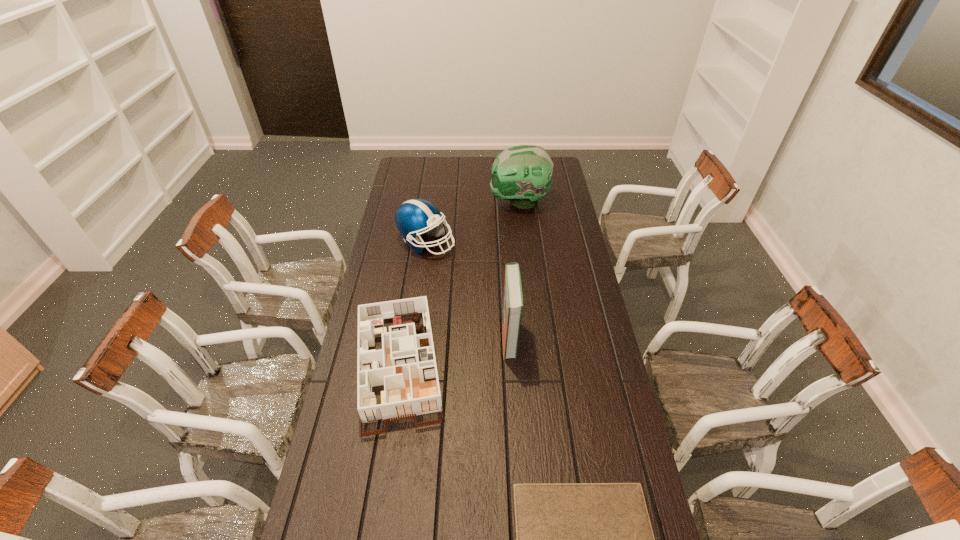
At what (x,y) coordinates should I click in order to perform the action: click on free space located on the cover of the hardback book. Please return your answer as a coordinate pair (x, y). This screenshot has height=540, width=960. Looking at the image, I should click on (421, 338).

Identify the location of vacant space located on the cover of the hardback book. (444, 338).

Where is `vacant region located 0.150m at the front of the shorter football helmet with the faceguard`? The width and height of the screenshot is (960, 540). vacant region located 0.150m at the front of the shorter football helmet with the faceguard is located at coordinates (489, 242).

Find the location of `free space located on the back of the dollhouse`. free space located on the back of the dollhouse is located at coordinates (411, 292).

Where is `football helmet present at the left edge`? This screenshot has width=960, height=540. football helmet present at the left edge is located at coordinates (414, 217).

Find the location of a particular element. The height and width of the screenshot is (540, 960). dollhouse present at the left edge is located at coordinates (405, 364).

Find the location of `object located at the right edge`. object located at the right edge is located at coordinates (522, 174).

This screenshot has height=540, width=960. In the image, there is a desktop. What are the coordinates of `free space at the far edge` in the screenshot? It's located at (429, 172).

The width and height of the screenshot is (960, 540). In the image, there is a desktop. Find the location of `vacant space at the left edge`. vacant space at the left edge is located at coordinates (403, 181).

Identify the location of vacant position at the right edge of the desktop. The image size is (960, 540). (625, 428).